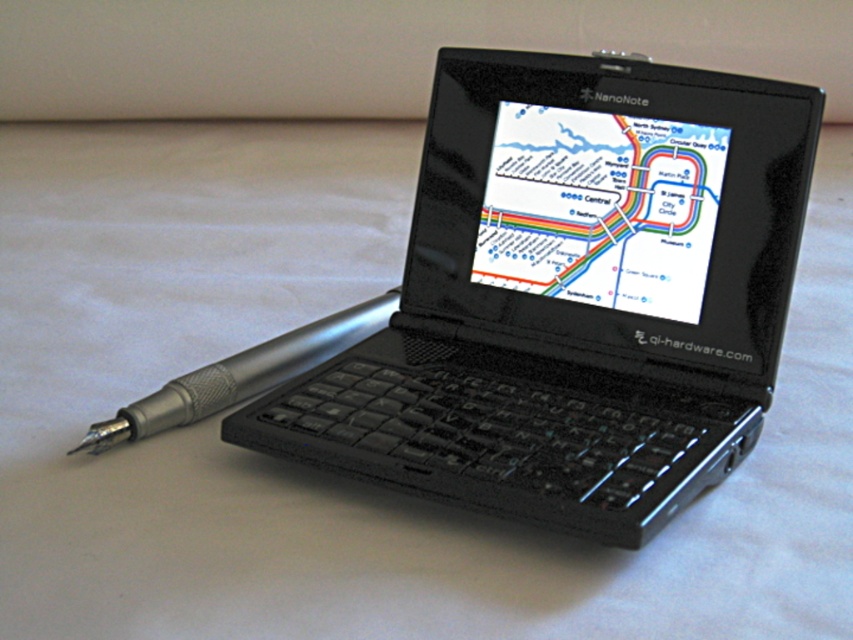
Question: Is matte plastic map at center wider than silver metallic pen at left?

Choices:
 (A) no
 (B) yes

Answer: (A)

Question: Estimate the real-world distances between objects in this image. Which object is closer to the matte plastic map at center?

Choices:
 (A) silver metallic pen at left
 (B) black matte laptop at center

Answer: (B)

Question: Does matte plastic map at center have a larger size compared to silver metallic pen at left?

Choices:
 (A) no
 (B) yes

Answer: (A)

Question: Can you confirm if black matte laptop at center is bigger than matte plastic map at center?

Choices:
 (A) no
 (B) yes

Answer: (B)

Question: Which point is closer to the camera taking this photo?

Choices:
 (A) (212, 380)
 (B) (527, 113)

Answer: (A)

Question: Which point appears closest to the camera in this image?

Choices:
 (A) (619, 253)
 (B) (616, 248)
 (C) (279, 376)

Answer: (A)